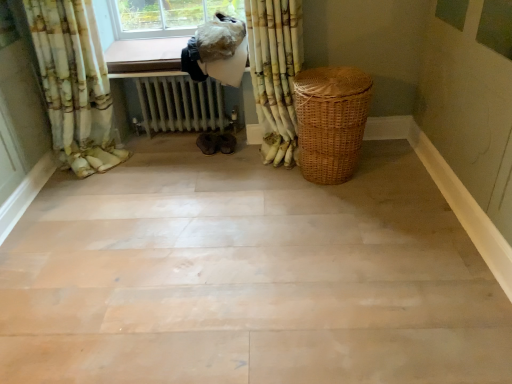
Where is `free location in front of white metallic radiator at center`? The image size is (512, 384). free location in front of white metallic radiator at center is located at coordinates (189, 169).